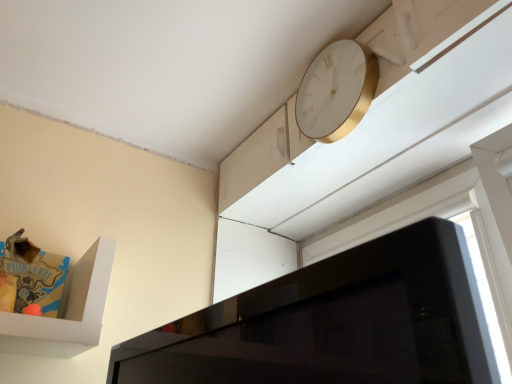
Question: From a real-world perspective, is white glossy window at upper right below white gold clock at upper right?

Choices:
 (A) no
 (B) yes

Answer: (B)

Question: Would you say white gold clock at upper right is part of white glossy window at upper right's contents?

Choices:
 (A) yes
 (B) no

Answer: (B)

Question: From a real-world perspective, is white glossy window at upper right on top of white gold clock at upper right?

Choices:
 (A) no
 (B) yes

Answer: (A)

Question: Considering the relative sizes of white glossy window at upper right and white gold clock at upper right in the image provided, is white glossy window at upper right wider than white gold clock at upper right?

Choices:
 (A) yes
 (B) no

Answer: (A)

Question: Can you confirm if white glossy window at upper right is smaller than white gold clock at upper right?

Choices:
 (A) no
 (B) yes

Answer: (A)

Question: Is white glossy window at upper right shorter than white gold clock at upper right?

Choices:
 (A) no
 (B) yes

Answer: (A)

Question: Would you say white glossy window at upper right is part of white gold clock at upper right's contents?

Choices:
 (A) yes
 (B) no

Answer: (B)

Question: Is the position of white gold clock at upper right more distant than that of white glossy window at upper right?

Choices:
 (A) yes
 (B) no

Answer: (A)

Question: Would you say white gold clock at upper right is outside white glossy window at upper right?

Choices:
 (A) no
 (B) yes

Answer: (B)

Question: From the image's perspective, is white gold clock at upper right below white glossy window at upper right?

Choices:
 (A) no
 (B) yes

Answer: (A)

Question: Can you confirm if white gold clock at upper right is thinner than white glossy window at upper right?

Choices:
 (A) no
 (B) yes

Answer: (B)

Question: Does white gold clock at upper right turn towards white glossy window at upper right?

Choices:
 (A) no
 (B) yes

Answer: (A)

Question: Considering the positions of white gold clock at upper right and white glossy window at upper right in the image, is white gold clock at upper right taller or shorter than white glossy window at upper right?

Choices:
 (A) short
 (B) tall

Answer: (A)